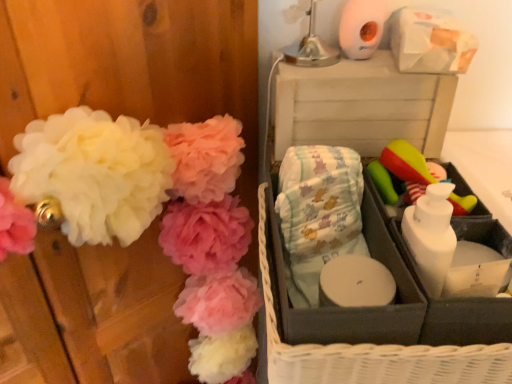
Question: Is white fluffy pom-poms at left smaller than gray fabric basket at right?

Choices:
 (A) yes
 (B) no

Answer: (B)

Question: From the image's perspective, is white fluffy pom-poms at left located beneath gray fabric basket at right?

Choices:
 (A) no
 (B) yes

Answer: (B)

Question: Does white fluffy pom-poms at left lie behind gray fabric basket at right?

Choices:
 (A) no
 (B) yes

Answer: (A)

Question: From a real-world perspective, is white fluffy pom-poms at left located beneath gray fabric basket at right?

Choices:
 (A) no
 (B) yes

Answer: (B)

Question: Considering the relative positions of white fluffy pom-poms at left and gray fabric basket at right in the image provided, is white fluffy pom-poms at left to the left of gray fabric basket at right from the viewer's perspective?

Choices:
 (A) yes
 (B) no

Answer: (A)

Question: Is white fluffy pom-poms at left turned away from gray fabric basket at right?

Choices:
 (A) no
 (B) yes

Answer: (A)

Question: Considering the relative sizes of white plastic storage box at upper right and green rubber brush at right in the image provided, is white plastic storage box at upper right taller than green rubber brush at right?

Choices:
 (A) yes
 (B) no

Answer: (A)

Question: Is white plastic storage box at upper right at the right side of green rubber brush at right?

Choices:
 (A) yes
 (B) no

Answer: (B)

Question: Can you see white plastic storage box at upper right touching green rubber brush at right?

Choices:
 (A) no
 (B) yes

Answer: (A)

Question: Is white plastic storage box at upper right smaller than green rubber brush at right?

Choices:
 (A) yes
 (B) no

Answer: (B)

Question: From a real-world perspective, is white plastic storage box at upper right positioned under green rubber brush at right based on gravity?

Choices:
 (A) yes
 (B) no

Answer: (A)

Question: Does white plastic storage box at upper right come in front of green rubber brush at right?

Choices:
 (A) yes
 (B) no

Answer: (B)

Question: Is gray fabric basket at right surrounding white plastic storage box at upper right?

Choices:
 (A) no
 (B) yes

Answer: (A)